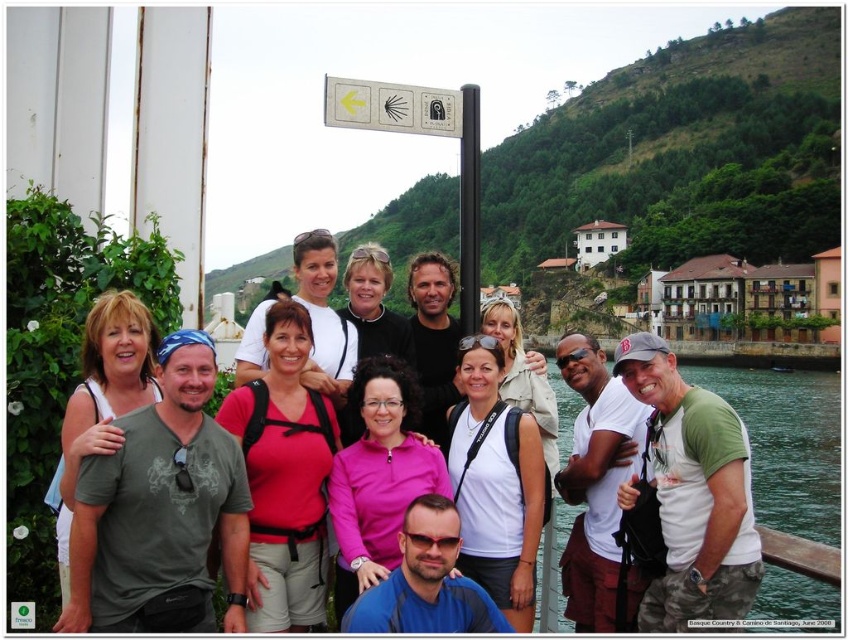
Question: Is transparent water at lower right bigger than white plastic sign at upper center?

Choices:
 (A) yes
 (B) no

Answer: (A)

Question: Considering the relative positions of transparent water at lower right and black metal pole at center in the image provided, where is transparent water at lower right located with respect to black metal pole at center?

Choices:
 (A) right
 (B) left

Answer: (A)

Question: Which point is closer to the camera taking this photo?

Choices:
 (A) (324, 93)
 (B) (771, 392)

Answer: (A)

Question: Does transparent water at lower right appear over white plastic sign at upper center?

Choices:
 (A) no
 (B) yes

Answer: (A)

Question: Which point is closer to the camera?

Choices:
 (A) transparent water at lower right
 (B) black metal pole at center
 (C) white plastic sign at upper center

Answer: (C)

Question: Considering the real-world distances, which object is farthest from the white plastic sign at upper center?

Choices:
 (A) black metal pole at center
 (B) transparent water at lower right

Answer: (B)